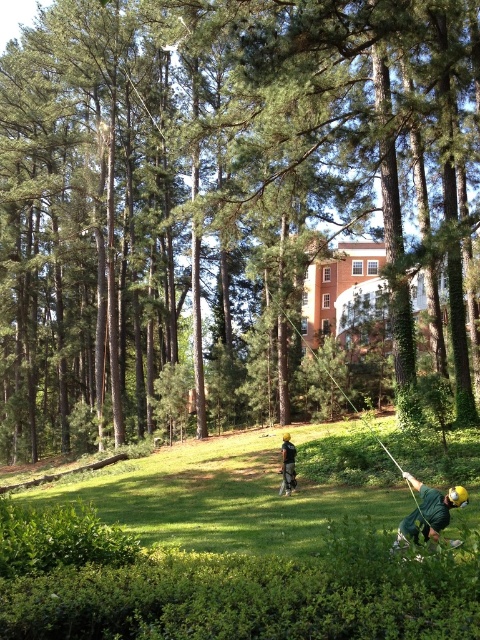
Which is above, green matte helmet at center or dark green fabric shirt at center?

green matte helmet at center is higher up.

Is green matte helmet at center to the right of dark green fabric shirt at center from the viewer's perspective?

Correct, you'll find green matte helmet at center to the right of dark green fabric shirt at center.

Find the location of `green matte helmet at center`. green matte helmet at center is located at coordinates [429, 512].

Is point (56, 492) positioned after point (289, 456)?

Yes, it is behind point (289, 456).

Does green grassy at lower center have a greater height compared to dark green fabric shirt at center?

Indeed, green grassy at lower center has a greater height compared to dark green fabric shirt at center.

Describe the element at coordinates (239, 492) in the screenshot. The width and height of the screenshot is (480, 640). I see `green grassy at lower center` at that location.

Where is `green grassy at lower center`? green grassy at lower center is located at coordinates (239, 492).

Consider the image. Who is higher up, green grassy at lower center or green matte helmet at center?

green matte helmet at center is higher up.

Does point (220, 522) lie behind point (430, 529)?

Yes, point (220, 522) is farther from viewer.

Locate an element on the screen. Image resolution: width=480 pixels, height=640 pixels. green grassy at lower center is located at coordinates (239, 492).